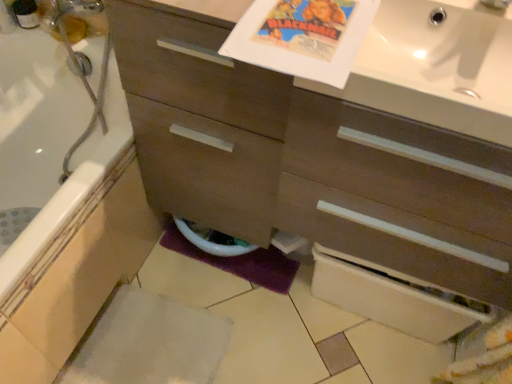
Question: Is white glossy sink at upper right turned away from matte brown cabinet at center?

Choices:
 (A) no
 (B) yes

Answer: (B)

Question: Is the position of white glossy sink at upper right less distant than that of matte brown cabinet at center?

Choices:
 (A) yes
 (B) no

Answer: (B)

Question: Can you confirm if white glossy sink at upper right is wider than matte brown cabinet at center?

Choices:
 (A) no
 (B) yes

Answer: (B)

Question: Is white glossy sink at upper right positioned behind matte brown cabinet at center?

Choices:
 (A) no
 (B) yes

Answer: (B)

Question: Is white glossy sink at upper right at the right side of matte brown cabinet at center?

Choices:
 (A) yes
 (B) no

Answer: (A)

Question: From the image's perspective, is white glossy bathtub at lower left located above or below matte brown cabinet at center?

Choices:
 (A) above
 (B) below

Answer: (B)

Question: Considering the relative positions of white glossy bathtub at lower left and matte brown cabinet at center in the image provided, is white glossy bathtub at lower left to the left or to the right of matte brown cabinet at center?

Choices:
 (A) left
 (B) right

Answer: (A)

Question: Relative to matte brown cabinet at center, is white glossy bathtub at lower left in front or behind?

Choices:
 (A) front
 (B) behind

Answer: (B)

Question: Do you think white glossy bathtub at lower left is within matte brown cabinet at center, or outside of it?

Choices:
 (A) inside
 (B) outside

Answer: (B)

Question: Which is correct: white glossy bathtub at lower left is inside white glossy sink at upper right, or outside of it?

Choices:
 (A) outside
 (B) inside

Answer: (A)

Question: From a real-world perspective, is white glossy bathtub at lower left above or below white glossy sink at upper right?

Choices:
 (A) below
 (B) above

Answer: (A)

Question: Considering the relative positions of white glossy bathtub at lower left and white glossy sink at upper right in the image provided, is white glossy bathtub at lower left to the left or to the right of white glossy sink at upper right?

Choices:
 (A) right
 (B) left

Answer: (B)

Question: In the image, is white glossy bathtub at lower left positioned in front of or behind white glossy sink at upper right?

Choices:
 (A) behind
 (B) front

Answer: (A)

Question: Choose the correct answer: Is white glossy sink at upper right inside white glossy toilet bowl at lower center or outside it?

Choices:
 (A) inside
 (B) outside

Answer: (B)

Question: Visually, is white glossy sink at upper right positioned to the left or to the right of white glossy toilet bowl at lower center?

Choices:
 (A) right
 (B) left

Answer: (A)